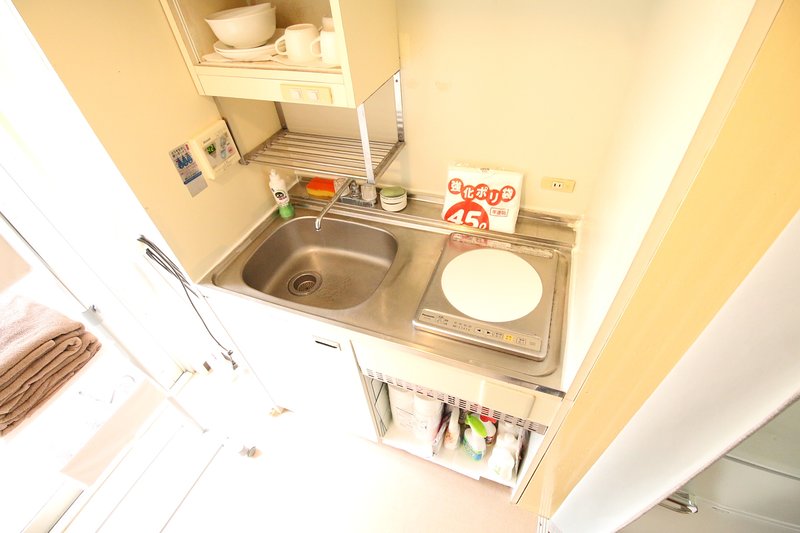
This screenshot has width=800, height=533. What are the coordinates of `sink` in the screenshot? It's located at (346, 282).